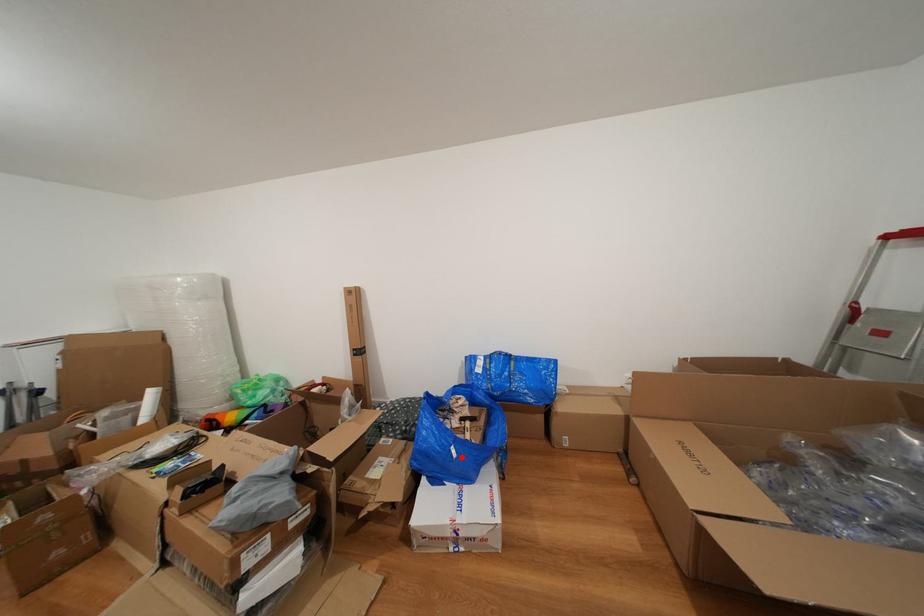
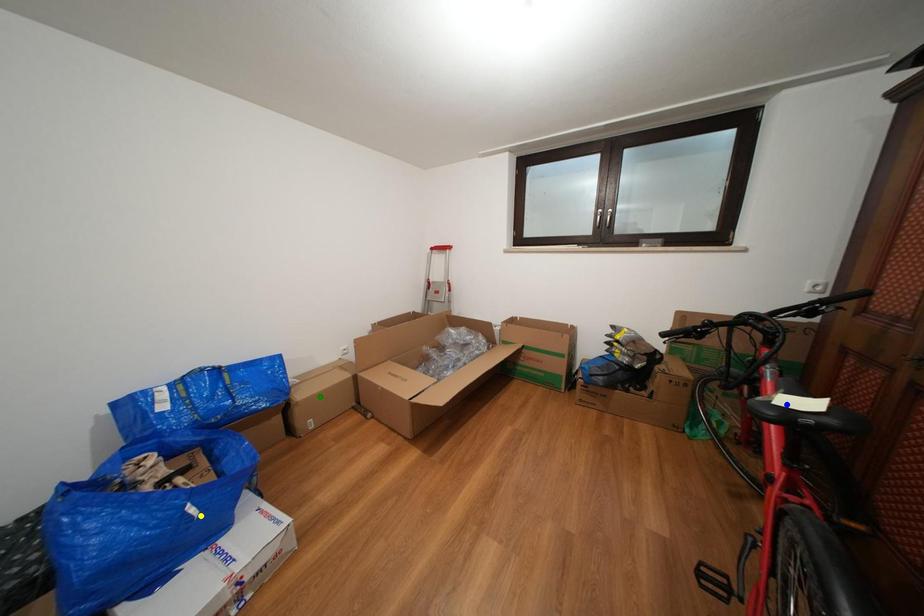
Question: I am providing you with two images of the same scene from different viewpoints. A red point is marked on the first image. You are given multiple points on the second image. Which point in image 2 represents the same 3d spot as the red point in image 1?

Choices:
 (A) green point
 (B) yellow point
 (C) blue point

Answer: (B)